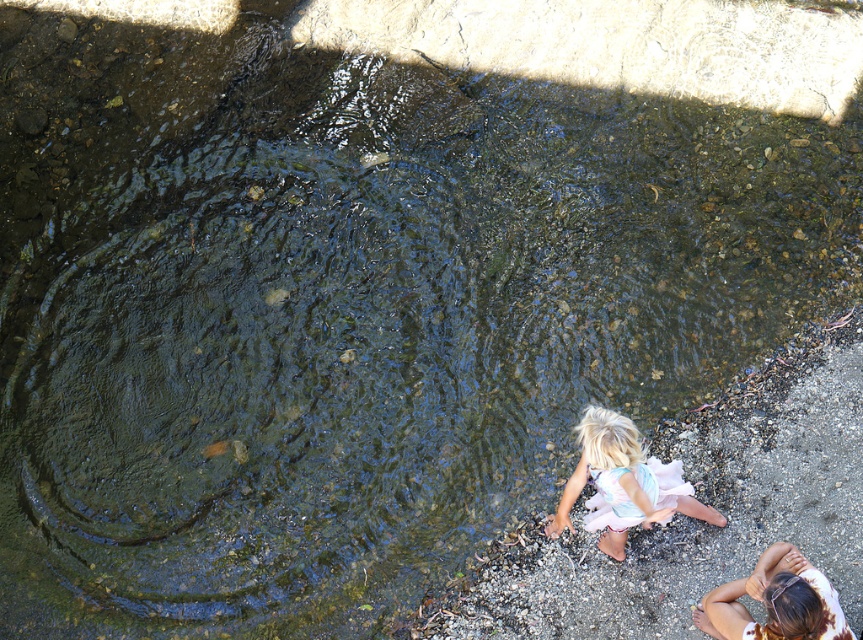
Question: Among these objects, which one is farthest from the camera?

Choices:
 (A) pastel floral dress at lower right
 (B) light brown hair at lower right

Answer: (A)

Question: Is pastel floral dress at lower right positioned in front of light brown hair at lower right?

Choices:
 (A) no
 (B) yes

Answer: (A)

Question: Can you confirm if pastel floral dress at lower right is positioned below light brown hair at lower right?

Choices:
 (A) yes
 (B) no

Answer: (B)

Question: Is pastel floral dress at lower right to the right of light brown hair at lower right from the viewer's perspective?

Choices:
 (A) yes
 (B) no

Answer: (B)